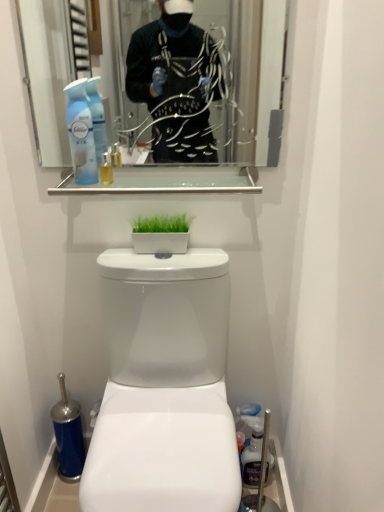
Question: From a real-world perspective, is clear glass shelf at upper center located higher than clear glass mirror at upper center?

Choices:
 (A) no
 (B) yes

Answer: (A)

Question: Is clear glass shelf at upper center looking in the opposite direction of clear glass mirror at upper center?

Choices:
 (A) yes
 (B) no

Answer: (B)

Question: Can you confirm if clear glass shelf at upper center is positioned to the right of clear glass mirror at upper center?

Choices:
 (A) no
 (B) yes

Answer: (B)

Question: Can you confirm if clear glass shelf at upper center is thinner than clear glass mirror at upper center?

Choices:
 (A) no
 (B) yes

Answer: (A)

Question: Could you tell me if clear glass shelf at upper center is turned towards clear glass mirror at upper center?

Choices:
 (A) yes
 (B) no

Answer: (B)

Question: Could clear glass mirror at upper center be considered to be inside clear glass shelf at upper center?

Choices:
 (A) no
 (B) yes

Answer: (A)

Question: Could you tell me if white glossy toilet at center is facing clear glass shelf at upper center?

Choices:
 (A) no
 (B) yes

Answer: (A)

Question: Considering the relative sizes of white glossy toilet at center and clear glass shelf at upper center in the image provided, is white glossy toilet at center thinner than clear glass shelf at upper center?

Choices:
 (A) no
 (B) yes

Answer: (A)

Question: Considering the relative sizes of white glossy toilet at center and clear glass shelf at upper center in the image provided, is white glossy toilet at center bigger than clear glass shelf at upper center?

Choices:
 (A) yes
 (B) no

Answer: (A)

Question: Is white glossy toilet at center wider than clear glass shelf at upper center?

Choices:
 (A) no
 (B) yes

Answer: (B)

Question: Is white glossy toilet at center at the right side of clear glass shelf at upper center?

Choices:
 (A) no
 (B) yes

Answer: (B)

Question: Is white glossy toilet at center surrounding clear glass shelf at upper center?

Choices:
 (A) no
 (B) yes

Answer: (A)

Question: From the image's perspective, does white glossy toilet at center appear lower than white glossy planter at center?

Choices:
 (A) yes
 (B) no

Answer: (A)